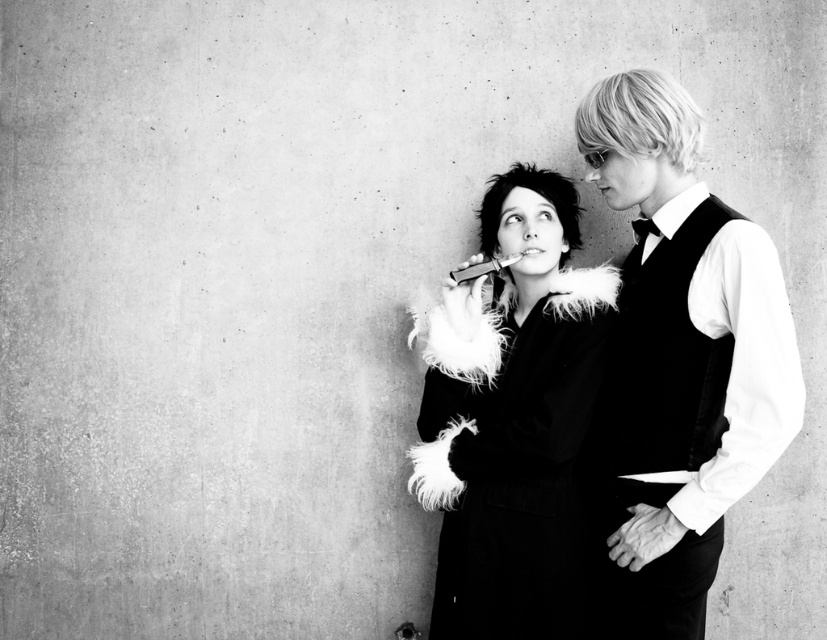
Can you confirm if feathered black vest at center is bigger than feathered black coat at center?

Actually, feathered black vest at center might be smaller than feathered black coat at center.

Between feathered black vest at center and feathered black coat at center, which one is positioned lower?

feathered black coat at center

Which is behind, point (622, 76) or point (445, 401)?

The point (445, 401) is behind.

Locate an element on the screen. feathered black vest at center is located at coordinates (679, 360).